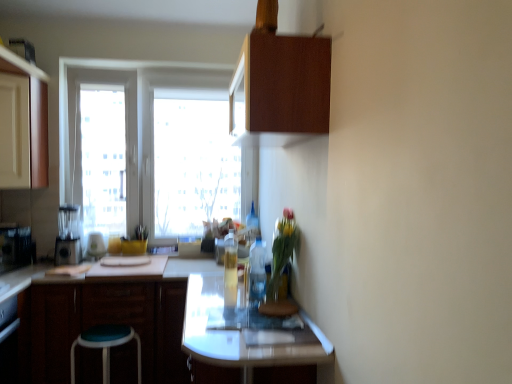
Question: Should I look upward or downward to see wooden cabinet at upper center, the 1th cabinetry when ordered from top to bottom?

Choices:
 (A) down
 (B) up

Answer: (B)

Question: Is metallic silver toaster at left, positioned as the 1th appliance in left-to-right order, not within matte black blender at left, which is the second appliance from left to right?

Choices:
 (A) yes
 (B) no

Answer: (A)

Question: Is metallic silver toaster at left, positioned as the 1th appliance in left-to-right order, shorter than matte black blender at left, which is the second appliance from left to right?

Choices:
 (A) no
 (B) yes

Answer: (B)

Question: Is matte black blender at left, which is counted as the 2th appliance, starting from the right, a part of metallic silver toaster at left, positioned as the 1th appliance in left-to-right order?

Choices:
 (A) no
 (B) yes

Answer: (A)

Question: From a real-world perspective, does metallic silver toaster at left, which appears as the 3th appliance when viewed from the right, sit lower than matte black blender at left, which is the second appliance from left to right?

Choices:
 (A) no
 (B) yes

Answer: (B)

Question: Can you confirm if metallic silver toaster at left, which appears as the 3th appliance when viewed from the right, is positioned to the left of matte black blender at left, which is counted as the 2th appliance, starting from the right?

Choices:
 (A) no
 (B) yes

Answer: (B)

Question: Considering the relative sizes of metallic silver toaster at left, which appears as the 3th appliance when viewed from the right, and matte black blender at left, which is the second appliance from left to right, in the image provided, is metallic silver toaster at left, which appears as the 3th appliance when viewed from the right, wider than matte black blender at left, which is the second appliance from left to right,?

Choices:
 (A) yes
 (B) no

Answer: (A)

Question: Can you confirm if translucent glass bottle at center, acting as the 2th bottle starting from the back, is positioned to the right of brushed metal blender at left, the 1th appliance from the right?

Choices:
 (A) no
 (B) yes

Answer: (B)

Question: Is translucent glass bottle at center, acting as the 2th bottle starting from the back, looking in the opposite direction of brushed metal blender at left, the 1th appliance from the right?

Choices:
 (A) no
 (B) yes

Answer: (A)

Question: Does translucent glass bottle at center, arranged as the 2th bottle when viewed from the front, have a greater height compared to brushed metal blender at left, the 1th appliance from the right?

Choices:
 (A) yes
 (B) no

Answer: (A)

Question: From the image's perspective, is translucent glass bottle at center, acting as the 2th bottle starting from the back, under brushed metal blender at left, acting as the 3th appliance starting from the left?

Choices:
 (A) yes
 (B) no

Answer: (A)

Question: Is translucent glass bottle at center, arranged as the 2th bottle when viewed from the front, wider than brushed metal blender at left, acting as the 3th appliance starting from the left?

Choices:
 (A) yes
 (B) no

Answer: (B)

Question: Considering the relative sizes of translucent glass bottle at center, arranged as the 2th bottle when viewed from the front, and brushed metal blender at left, acting as the 3th appliance starting from the left, in the image provided, is translucent glass bottle at center, arranged as the 2th bottle when viewed from the front, shorter than brushed metal blender at left, acting as the 3th appliance starting from the left,?

Choices:
 (A) yes
 (B) no

Answer: (B)

Question: Considering the relative positions of matte wood cabinet at left, the second cabinetry in the top-to-bottom sequence, and translucent glass bottle at upper center, arranged as the 1th bottle when viewed from the back, in the image provided, is matte wood cabinet at left, the second cabinetry in the top-to-bottom sequence, behind translucent glass bottle at upper center, arranged as the 1th bottle when viewed from the back,?

Choices:
 (A) no
 (B) yes

Answer: (A)